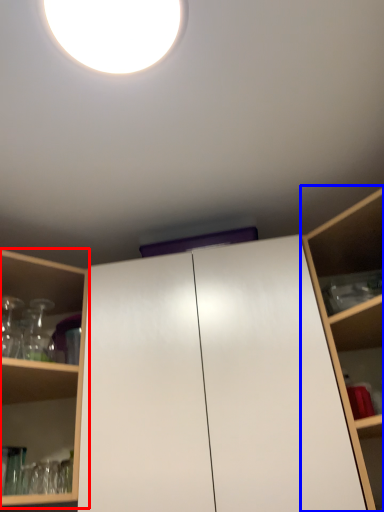
Question: Which object appears closest to the camera in this image, shelf (highlighted by a red box) or shelf (highlighted by a blue box)?

Choices:
 (A) shelf
 (B) shelf

Answer: (B)